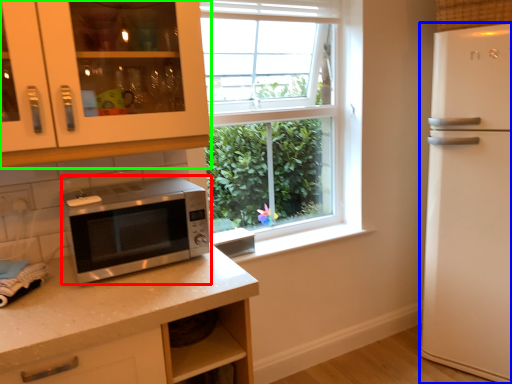
Question: Which is nearer to the microwave oven (highlighted by a red box)? refrigerator (highlighted by a blue box) or cabinetry (highlighted by a green box).

Choices:
 (A) refrigerator
 (B) cabinetry

Answer: (B)